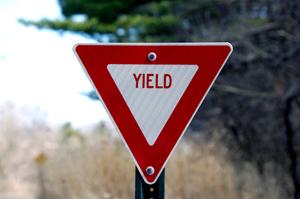
This screenshot has height=199, width=300. In order to click on lower washer in this screenshot , I will do `click(152, 168)`.